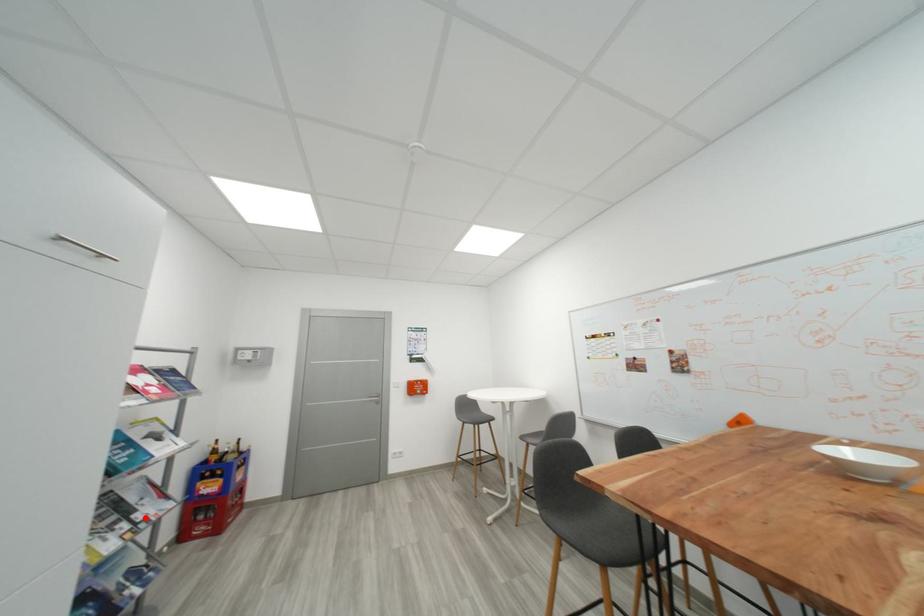
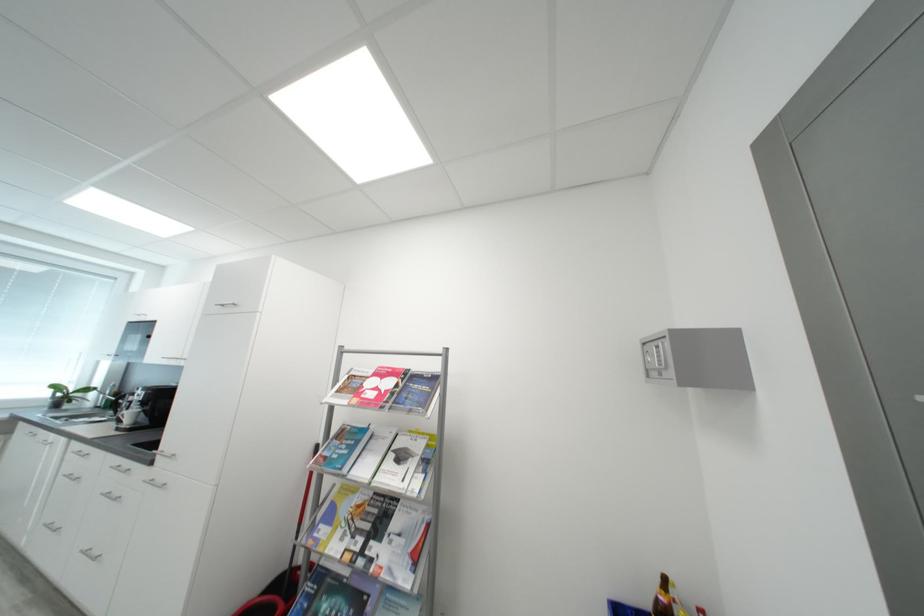
The point at the highlighted location is marked in the first image. Where is the corresponding point in the second image?

(380, 549)